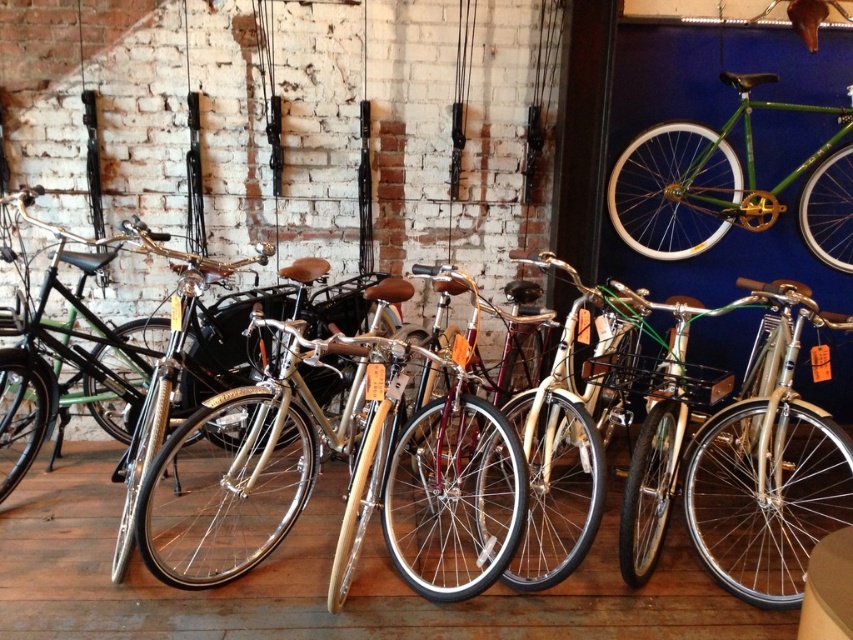
Question: Can you confirm if shiny silver bicycle at center is positioned to the right of shiny gold bicycle at center?

Choices:
 (A) yes
 (B) no

Answer: (A)

Question: Can you confirm if shiny gold bicycle at center is thinner than green matte bicycle at upper right?

Choices:
 (A) yes
 (B) no

Answer: (B)

Question: Which point is farther to the camera?

Choices:
 (A) shiny gold bicycle at center
 (B) shiny silver bicycle at center
 (C) green matte bicycle at upper right

Answer: (C)

Question: Among these points, which one is nearest to the camera?

Choices:
 (A) (733, 483)
 (B) (689, 205)
 (C) (196, 451)

Answer: (A)

Question: Which object appears farthest from the camera in this image?

Choices:
 (A) shiny silver bicycle at center
 (B) green matte bicycle at upper right

Answer: (B)

Question: Does shiny silver bicycle at center appear over green matte bicycle at upper right?

Choices:
 (A) yes
 (B) no

Answer: (B)